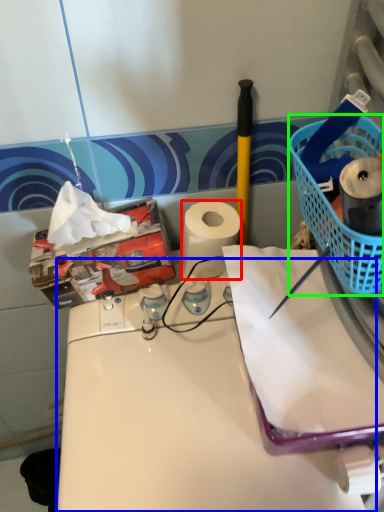
Question: Which object is the farthest from paper towel (highlighted by a red box)? Choose among these: counter (highlighted by a blue box) or basket (highlighted by a green box).

Choices:
 (A) counter
 (B) basket

Answer: (B)